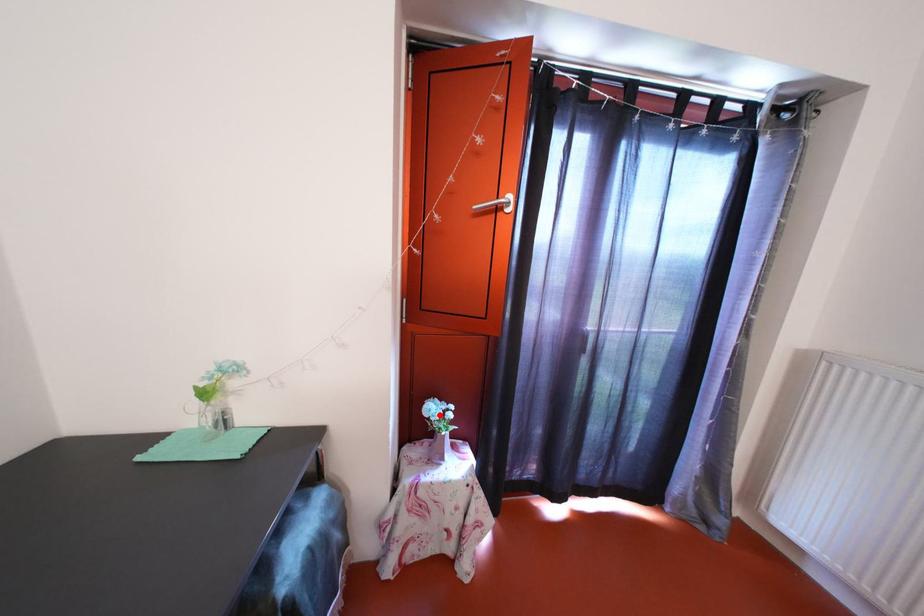
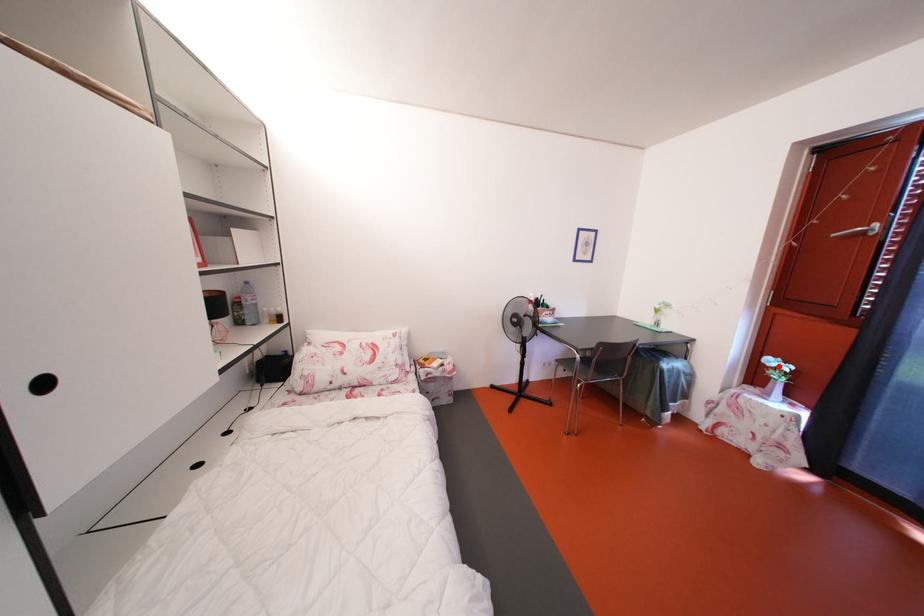
I am providing you with two images of the same scene from different viewpoints. A red point is marked on the first image and another point is marked on the second image. Are the points marked in image1 and image2 representing the same 3D position?

Yes